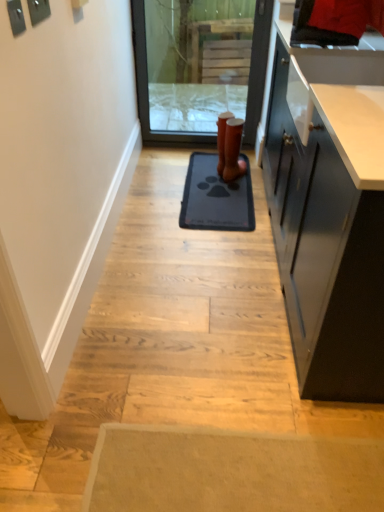
In order to click on free space in front of brown leather boot at center in this screenshot , I will do `click(235, 185)`.